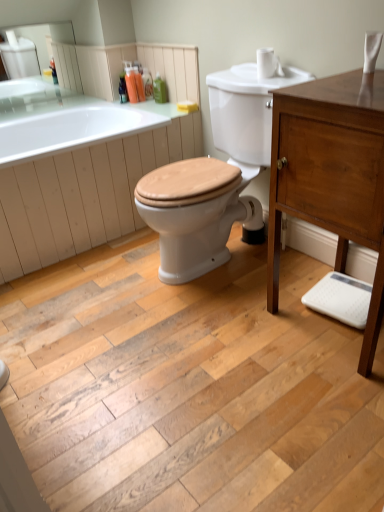
In order to click on free space in front of translucent plastic soap dispenser at upper center, positioned as the third toiletry in left-to-right order in this screenshot , I will do `click(152, 102)`.